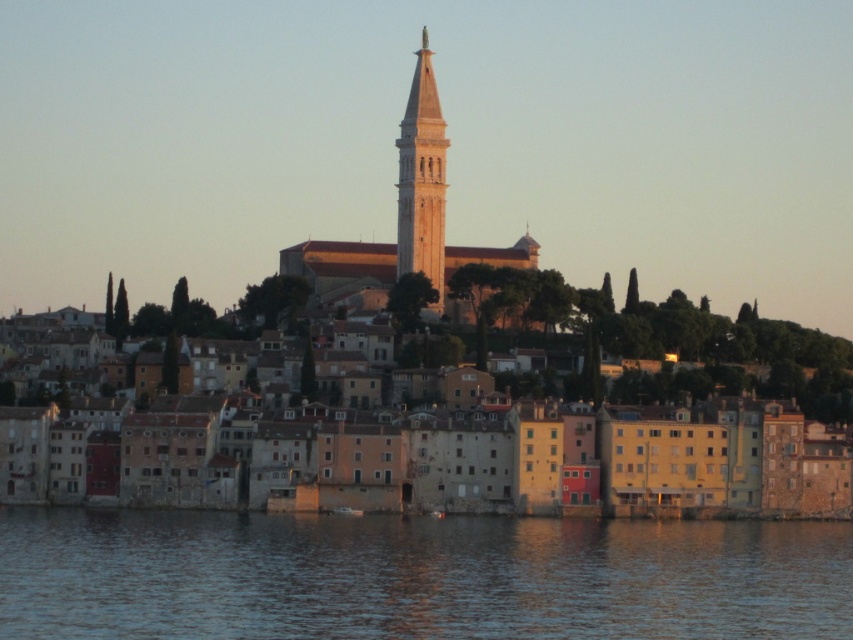
Does blue water at lower center have a lesser height compared to light beige stone bell tower at center?

Correct, blue water at lower center is not as tall as light beige stone bell tower at center.

Is blue water at lower center wider than light beige stone bell tower at center?

Indeed, blue water at lower center has a greater width compared to light beige stone bell tower at center.

Locate an element on the screen. blue water at lower center is located at coordinates (416, 577).

This screenshot has width=853, height=640. I want to click on blue water at lower center, so click(416, 577).

Does blue water at lower center have a lesser width compared to stone buildings at center?

Indeed, blue water at lower center has a lesser width compared to stone buildings at center.

Who is positioned more to the left, blue water at lower center or stone buildings at center?

Positioned to the left is blue water at lower center.

You are a GUI agent. You are given a task and a screenshot of the screen. Output one action in this format:
    pyautogui.click(x=<x>, y=<y>)
    Task: Click on the blue water at lower center
    The width and height of the screenshot is (853, 640).
    Given the screenshot: What is the action you would take?
    pyautogui.click(x=416, y=577)

Does stone buildings at center have a greater width compared to light beige stone bell tower at center?

Indeed, stone buildings at center has a greater width compared to light beige stone bell tower at center.

Is point (788, 364) more distant than point (415, 262)?

No, (788, 364) is in front of (415, 262).

This screenshot has height=640, width=853. I want to click on stone buildings at center, so click(x=724, y=356).